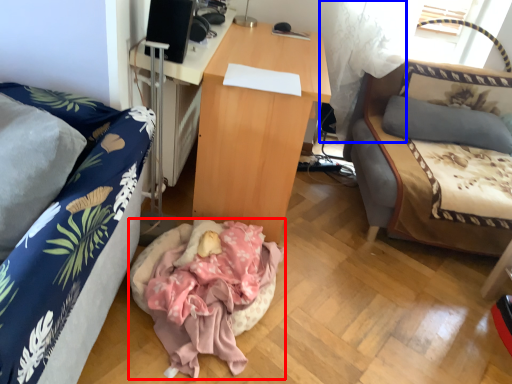
Question: Which object is closer to the camera taking this photo, infant bed (highlighted by a red box) or curtain (highlighted by a blue box)?

Choices:
 (A) infant bed
 (B) curtain

Answer: (A)